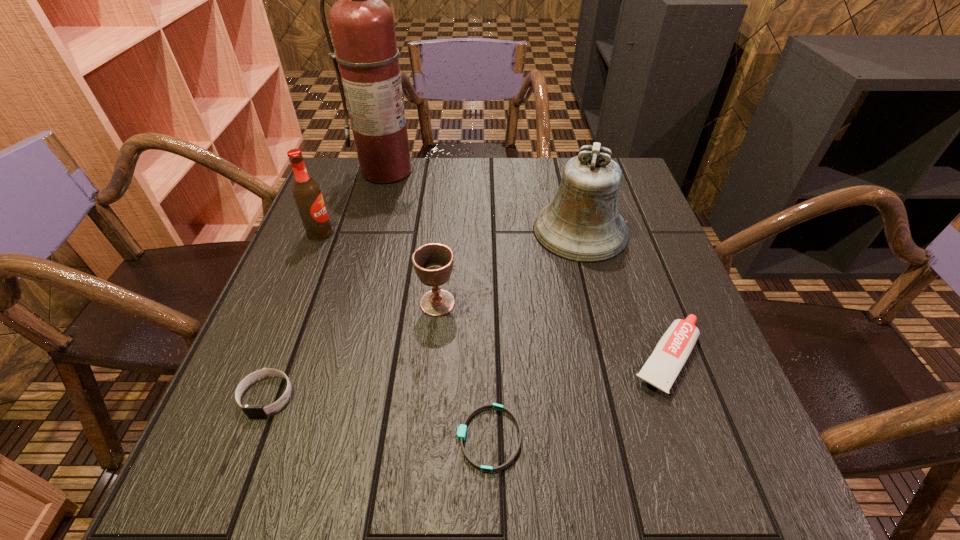
You are a GUI agent. You are given a task and a screenshot of the screen. Output one action in this format:
    pyautogui.click(x=<x>, y=<y>)
    Task: Click on the farthest object
    
    Given the screenshot: What is the action you would take?
    pyautogui.click(x=362, y=24)

Image resolution: width=960 pixels, height=540 pixels. In order to click on the tallest object in this screenshot , I will do `click(362, 24)`.

Where is `bell`? bell is located at coordinates (582, 224).

The height and width of the screenshot is (540, 960). Find the location of `beer bottle`. beer bottle is located at coordinates (306, 192).

Locate an element on the screen. The image size is (960, 540). chalice is located at coordinates (433, 263).

The height and width of the screenshot is (540, 960). What are the coordinates of `the fourth object from right to left` in the screenshot? It's located at (433, 263).

Locate an element on the screen. Image resolution: width=960 pixels, height=540 pixels. toothpaste is located at coordinates (661, 369).

Find the location of `the left wristband`. the left wristband is located at coordinates (250, 410).

Locate an element on the screen. The image size is (960, 540). the sixth tallest object is located at coordinates (250, 410).

You are a GUI agent. You are given a task and a screenshot of the screen. Output one action in this format:
    pyautogui.click(x=<x>, y=<y>)
    Task: Click on the shortest object
    
    Given the screenshot: What is the action you would take?
    pyautogui.click(x=462, y=429)